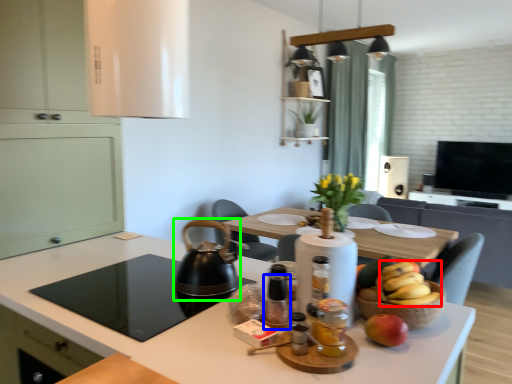
Question: Which object is the closest to the banana (highlighted by a red box)? Choose among these: bottle (highlighted by a blue box) or tea pot (highlighted by a green box).

Choices:
 (A) bottle
 (B) tea pot

Answer: (A)